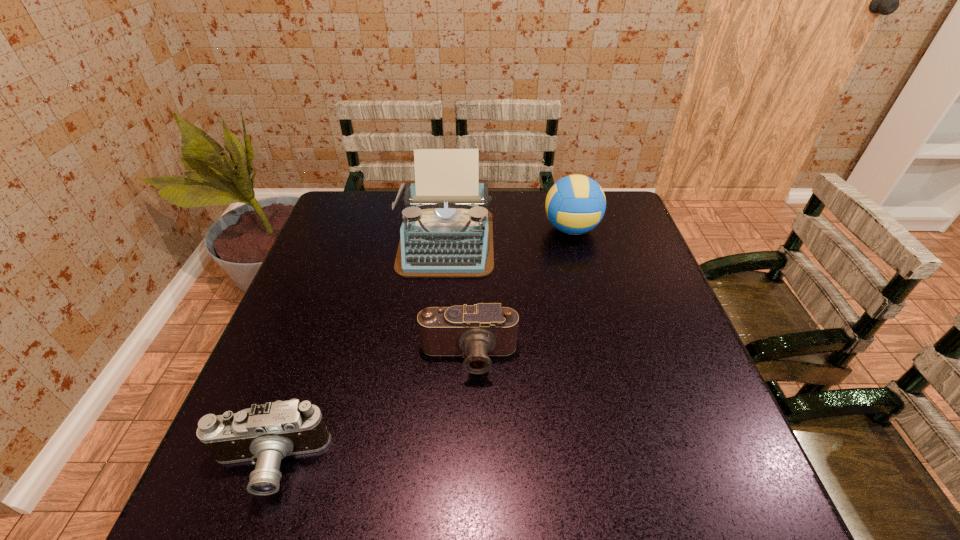
Where is `typewriter located at the far edge`? The width and height of the screenshot is (960, 540). typewriter located at the far edge is located at coordinates (447, 231).

At what (x,y) coordinates should I click in order to perform the action: click on volleyball that is at the far edge. Please return your answer as a coordinate pair (x, y). Looking at the image, I should click on (575, 204).

You are a GUI agent. You are given a task and a screenshot of the screen. Output one action in this format:
    pyautogui.click(x=<x>, y=<y>)
    Task: Click on the object located at the near edge
    This screenshot has width=960, height=540.
    Given the screenshot: What is the action you would take?
    pyautogui.click(x=264, y=434)

Identify the location of object that is at the left edge. (264, 434).

Where is `object present at the right edge`? object present at the right edge is located at coordinates (575, 204).

Locate an element on the screen. Image resolution: width=960 pixels, height=540 pixels. object that is at the near left corner is located at coordinates (264, 434).

Locate an element on the screen. This screenshot has width=960, height=540. object positioned at the far right corner is located at coordinates (575, 204).

In the image, there is a desktop. Identify the location of vacant area at the far edge. (516, 192).

This screenshot has width=960, height=540. In the image, there is a desktop. Find the location of `vacant space at the near edge`. vacant space at the near edge is located at coordinates (340, 518).

Locate an element on the screen. blank space at the left edge of the desktop is located at coordinates (329, 348).